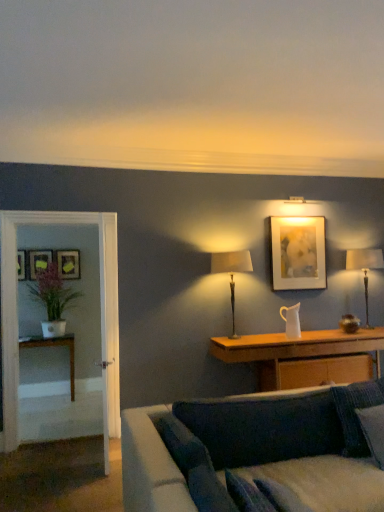
The height and width of the screenshot is (512, 384). What are the coordinates of `free point above matte white picture frame at upper right, the 1th picture frame from the front (from a real-world perspective)` in the screenshot? It's located at (298, 213).